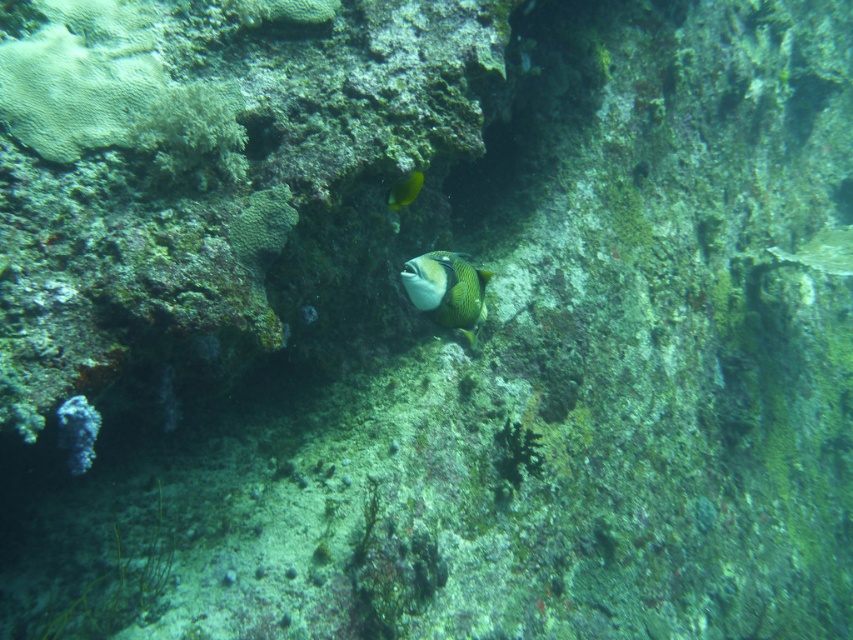
Question: Does green textured fish at center appear on the right side of yellow matte fish at upper center?

Choices:
 (A) yes
 (B) no

Answer: (A)

Question: Is green textured fish at center below yellow matte fish at upper center?

Choices:
 (A) yes
 (B) no

Answer: (A)

Question: Which of the following is the closest to the observer?

Choices:
 (A) (405, 184)
 (B) (407, 269)

Answer: (A)

Question: Can you confirm if green textured fish at center is thinner than yellow matte fish at upper center?

Choices:
 (A) yes
 (B) no

Answer: (B)

Question: Which object appears closest to the camera in this image?

Choices:
 (A) yellow matte fish at upper center
 (B) green textured fish at center

Answer: (A)

Question: Which object is farther from the camera taking this photo?

Choices:
 (A) green textured fish at center
 (B) yellow matte fish at upper center

Answer: (A)